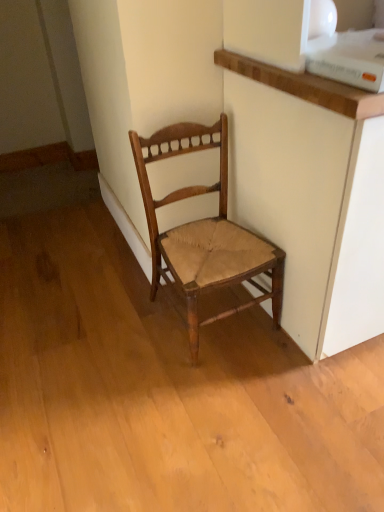
The width and height of the screenshot is (384, 512). Describe the element at coordinates (204, 232) in the screenshot. I see `wooden woven seat chair at center` at that location.

Where is `wooden woven seat chair at center`? Image resolution: width=384 pixels, height=512 pixels. wooden woven seat chair at center is located at coordinates (204, 232).

Looking at this image, what is the approximate width of matte white cabinet at upper right?

27.25 inches.

What do you see at coordinates (314, 104) in the screenshot? Image resolution: width=384 pixels, height=512 pixels. I see `matte white cabinet at upper right` at bounding box center [314, 104].

Based on the photo, what is the approximate height of matte white cabinet at upper right?

82.27 centimeters.

Identify the location of matte white cabinet at upper right. (314, 104).

This screenshot has width=384, height=512. In order to click on wooden woven seat chair at center in this screenshot , I will do `click(204, 232)`.

Is wooden woven seat chair at center to the left of matte white cabinet at upper right from the viewer's perspective?

Yes, wooden woven seat chair at center is to the left of matte white cabinet at upper right.

Is wooden woven seat chair at center closer to the viewer compared to matte white cabinet at upper right?

No.

Which is closer to the camera, (227,131) or (336,241)?

The point (336,241) is closer to the camera.

From the image's perspective, which one is positioned lower, wooden woven seat chair at center or matte white cabinet at upper right?

wooden woven seat chair at center.

From a real-world perspective, which object rests below the other?

wooden woven seat chair at center is physically lower.

Between wooden woven seat chair at center and matte white cabinet at upper right, which one has smaller width?

With smaller width is wooden woven seat chair at center.

Consider the image. Considering the sizes of objects wooden woven seat chair at center and matte white cabinet at upper right in the image provided, who is taller, wooden woven seat chair at center or matte white cabinet at upper right?

matte white cabinet at upper right is taller.

Based on the photo, considering the sizes of objects wooden woven seat chair at center and matte white cabinet at upper right in the image provided, who is smaller, wooden woven seat chair at center or matte white cabinet at upper right?

Smaller between the two is wooden woven seat chair at center.

Is matte white cabinet at upper right inside wooden woven seat chair at center?

No, matte white cabinet at upper right is not inside wooden woven seat chair at center.

Is wooden woven seat chair at center in contact with matte white cabinet at upper right?

No, wooden woven seat chair at center is not touching matte white cabinet at upper right.

Is wooden woven seat chair at center oriented towards matte white cabinet at upper right?

No, wooden woven seat chair at center is not aimed at matte white cabinet at upper right.

What's the angular difference between wooden woven seat chair at center and matte white cabinet at upper right's facing directions?

There is a 3.49-degree angle between the facing directions of wooden woven seat chair at center and matte white cabinet at upper right.

How far apart are wooden woven seat chair at center and matte white cabinet at upper right?

11.37 inches.

Image resolution: width=384 pixels, height=512 pixels. What are the coordinates of `chair lying below the matte white cabinet at upper right (from the image's perspective)` in the screenshot? It's located at (204, 232).

Considering the relative positions of matte white cabinet at upper right and wooden woven seat chair at center in the image provided, is matte white cabinet at upper right to the left or to the right of wooden woven seat chair at center?

Clearly, matte white cabinet at upper right is on the right of wooden woven seat chair at center in the image.

Based on the photo, considering the positions of objects matte white cabinet at upper right and wooden woven seat chair at center in the image provided, who is in front, matte white cabinet at upper right or wooden woven seat chair at center?

matte white cabinet at upper right is more forward.

Considering the positions of points (304, 79) and (160, 257), is point (304, 79) farther from camera compared to point (160, 257)?

No.

From the image's perspective, is matte white cabinet at upper right located above wooden woven seat chair at center?

Yes, from the image's perspective, matte white cabinet at upper right is on top of wooden woven seat chair at center.

Consider the image. From a real-world perspective, is matte white cabinet at upper right over wooden woven seat chair at center?

Yes, from a real-world perspective, matte white cabinet at upper right is above wooden woven seat chair at center.

Which of these two, matte white cabinet at upper right or wooden woven seat chair at center, is wider?

matte white cabinet at upper right.

Between matte white cabinet at upper right and wooden woven seat chair at center, which one has less height?

wooden woven seat chair at center.

Based on the photo, is matte white cabinet at upper right bigger than wooden woven seat chair at center?

Yes, matte white cabinet at upper right is bigger than wooden woven seat chair at center.

Based on the photo, is matte white cabinet at upper right outside of wooden woven seat chair at center?

matte white cabinet at upper right lies outside wooden woven seat chair at center's area.

Is matte white cabinet at upper right far from wooden woven seat chair at center?

No, matte white cabinet at upper right is in close proximity to wooden woven seat chair at center.

Is wooden woven seat chair at center at the back of matte white cabinet at upper right?

No, wooden woven seat chair at center is not at the back of matte white cabinet at upper right.

Can you tell me how much matte white cabinet at upper right and wooden woven seat chair at center differ in facing direction?

The angular difference between matte white cabinet at upper right and wooden woven seat chair at center is 3.49 degrees.

How distant is matte white cabinet at upper right from wooden woven seat chair at center?

A distance of 11.37 inches exists between matte white cabinet at upper right and wooden woven seat chair at center.

Locate an element on the screen. The height and width of the screenshot is (512, 384). cabinetry to the right of wooden woven seat chair at center is located at coordinates (314, 104).

Where is `chair on the left of matte white cabinet at upper right`? The width and height of the screenshot is (384, 512). chair on the left of matte white cabinet at upper right is located at coordinates (204, 232).

Locate an element on the screen. Image resolution: width=384 pixels, height=512 pixels. chair below the matte white cabinet at upper right (from the image's perspective) is located at coordinates (204, 232).